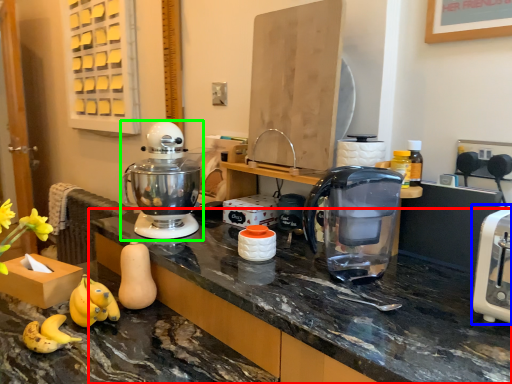
Question: Estimate the real-world distances between objects in this image. Which object is closer to countertop (highlighted by a red box), toaster (highlighted by a blue box) or mixer (highlighted by a green box)?

Choices:
 (A) toaster
 (B) mixer

Answer: (B)